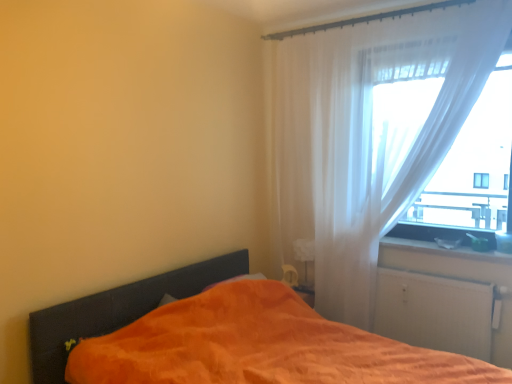
Describe the element at coordinates (371, 135) in the screenshot. I see `sheer white curtain at right` at that location.

Locate an element on the screen. Image resolution: width=512 pixels, height=384 pixels. sheer white curtain at right is located at coordinates (371, 135).

Locate an element on the screen. This screenshot has height=384, width=512. white glossy window sill at lower right is located at coordinates (443, 239).

Is sheer white curtain at right thinner than orange soft fabric bed at lower left?

Yes.

Which is closer, (308, 219) or (456, 285)?

Point (308, 219) is positioned farther from the camera compared to point (456, 285).

Which is correct: sheer white curtain at right is inside orange soft fabric bed at lower left, or outside of it?

sheer white curtain at right is outside orange soft fabric bed at lower left.

Between sheer white curtain at right and orange soft fabric bed at lower left, which one has less height?

With less height is orange soft fabric bed at lower left.

Looking at this image, which of these two, white matte radiator at lower right or white glossy window sill at lower right, is bigger?

With larger size is white matte radiator at lower right.

Is white matte radiator at lower right facing away from white glossy window sill at lower right?

No, white glossy window sill at lower right is not at the back of white matte radiator at lower right.

How far apart are white matte radiator at lower right and white glossy window sill at lower right?

white matte radiator at lower right and white glossy window sill at lower right are 13.99 inches apart from each other.

From the image's perspective, between white matte radiator at lower right and white glossy window sill at lower right, who is located below?

white matte radiator at lower right is shown below in the image.

Looking at their sizes, would you say orange soft fabric bed at lower left is wider or thinner than white matte radiator at lower right?

orange soft fabric bed at lower left is wider than white matte radiator at lower right.

Measure the distance from orange soft fabric bed at lower left to white matte radiator at lower right.

1.41 meters.

Which object is positioned more to the left, orange soft fabric bed at lower left or white matte radiator at lower right?

From the viewer's perspective, orange soft fabric bed at lower left appears more on the left side.

From a real-world perspective, is orange soft fabric bed at lower left located higher than white matte radiator at lower right?

No, from a real-world perspective, orange soft fabric bed at lower left is not above white matte radiator at lower right.

Considering the positions of objects orange soft fabric bed at lower left and white glossy window sill at lower right in the image provided, who is more to the right, orange soft fabric bed at lower left or white glossy window sill at lower right?

Positioned to the right is white glossy window sill at lower right.

In terms of width, does orange soft fabric bed at lower left look wider or thinner when compared to white glossy window sill at lower right?

In the image, orange soft fabric bed at lower left appears to be wider than white glossy window sill at lower right.

Could you tell me if orange soft fabric bed at lower left is facing white glossy window sill at lower right?

No.

Is orange soft fabric bed at lower left completely or partially outside of white glossy window sill at lower right?

Absolutely, orange soft fabric bed at lower left is external to white glossy window sill at lower right.

From their relative heights in the image, would you say white matte radiator at lower right is taller or shorter than orange soft fabric bed at lower left?

Clearly, white matte radiator at lower right is shorter compared to orange soft fabric bed at lower left.

Can you confirm if white matte radiator at lower right is wider than orange soft fabric bed at lower left?

Incorrect, the width of white matte radiator at lower right does not surpass that of orange soft fabric bed at lower left.

The width and height of the screenshot is (512, 384). In the image, there is a orange soft fabric bed at lower left. Identify the location of screen door above it (from the image's perspective). (435, 312).

Between white matte radiator at lower right and orange soft fabric bed at lower left, which one has larger size?

orange soft fabric bed at lower left is bigger.

Locate an element on the screen. screen door below the white glossy window sill at lower right (from the image's perspective) is located at coordinates (435, 312).

Is white glossy window sill at lower right wider or thinner than white matte radiator at lower right?

white glossy window sill at lower right is wider than white matte radiator at lower right.

Is white glossy window sill at lower right not inside white matte radiator at lower right?

white glossy window sill at lower right lies outside white matte radiator at lower right's area.

Which of these two, white glossy window sill at lower right or white matte radiator at lower right, is smaller?

white glossy window sill at lower right is smaller.

Between sheer white curtain at right and white glossy window sill at lower right, which one appears on the right side from the viewer's perspective?

From the viewer's perspective, white glossy window sill at lower right appears more on the right side.

Is sheer white curtain at right not near white glossy window sill at lower right?

No, sheer white curtain at right is not far away from white glossy window sill at lower right.

What are the coordinates of `window sill below the sheer white curtain at right (from a real-world perspective)` in the screenshot? It's located at (443, 239).

Based on their sizes in the image, would you say sheer white curtain at right is bigger or smaller than white glossy window sill at lower right?

sheer white curtain at right is bigger than white glossy window sill at lower right.

I want to click on curtain that appears above the orange soft fabric bed at lower left (from a real-world perspective), so click(371, 135).

In the image, there is a white glossy window sill at lower right. Where is `screen door below it (from a real-world perspective)`? This screenshot has height=384, width=512. screen door below it (from a real-world perspective) is located at coordinates (435, 312).

Based on their spatial positions, is white glossy window sill at lower right or orange soft fabric bed at lower left further from sheer white curtain at right?

Based on the image, orange soft fabric bed at lower left appears to be further to sheer white curtain at right.

When comparing their distances from orange soft fabric bed at lower left, does white glossy window sill at lower right or sheer white curtain at right seem further?

white glossy window sill at lower right.

Which object lies further to the anchor point orange soft fabric bed at lower left, sheer white curtain at right or white glossy window sill at lower right?

white glossy window sill at lower right lies further to orange soft fabric bed at lower left than the other object.

Which object lies further to the anchor point white glossy window sill at lower right, orange soft fabric bed at lower left or white matte radiator at lower right?

The object further to white glossy window sill at lower right is orange soft fabric bed at lower left.

When comparing their distances from orange soft fabric bed at lower left, does white matte radiator at lower right or sheer white curtain at right seem further?

The object further to orange soft fabric bed at lower left is white matte radiator at lower right.

Estimate the real-world distances between objects in this image. Which object is further from sheer white curtain at right, orange soft fabric bed at lower left or white matte radiator at lower right?

The object further to sheer white curtain at right is orange soft fabric bed at lower left.

Considering their positions, is orange soft fabric bed at lower left positioned further to white glossy window sill at lower right than sheer white curtain at right?

orange soft fabric bed at lower left lies further to white glossy window sill at lower right than the other object.

Considering their positions, is orange soft fabric bed at lower left positioned closer to sheer white curtain at right than white glossy window sill at lower right?

Among the two, white glossy window sill at lower right is located nearer to sheer white curtain at right.

Where is `curtain between orange soft fabric bed at lower left and white matte radiator at lower right along the z-axis`? curtain between orange soft fabric bed at lower left and white matte radiator at lower right along the z-axis is located at coordinates (371, 135).

Where is `curtain between orange soft fabric bed at lower left and white glossy window sill at lower right along the z-axis`? This screenshot has width=512, height=384. curtain between orange soft fabric bed at lower left and white glossy window sill at lower right along the z-axis is located at coordinates (371, 135).

I want to click on window sill that lies between sheer white curtain at right and white matte radiator at lower right from top to bottom, so click(443, 239).

Where is `screen door between orange soft fabric bed at lower left and white glossy window sill at lower right in the front-back direction`? Image resolution: width=512 pixels, height=384 pixels. screen door between orange soft fabric bed at lower left and white glossy window sill at lower right in the front-back direction is located at coordinates (435, 312).